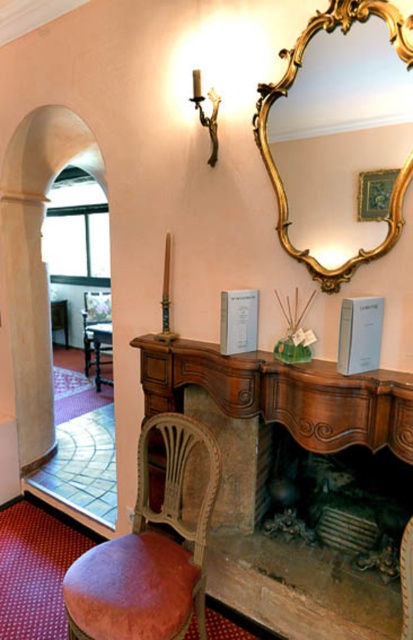
Who is taller, wooden fireplace at center or velvet red armchair at lower left?

With more height is wooden fireplace at center.

Identify the location of wooden fireplace at center. tap(285, 394).

Between point (152, 401) and point (218, 465), which one is positioned behind?

The point (152, 401) is more distant.

Where is `wooden fireplace at center`? This screenshot has width=413, height=640. wooden fireplace at center is located at coordinates (285, 394).

What do you see at coordinates (147, 554) in the screenshot? This screenshot has width=413, height=640. I see `velvet red armchair at lower left` at bounding box center [147, 554].

Does velvet red armchair at lower left have a lesser height compared to wooden armchair at left?

In fact, velvet red armchair at lower left may be taller than wooden armchair at left.

Is point (185, 611) behind point (104, 312)?

No.

Find the location of a particular element. The width and height of the screenshot is (413, 640). velvet red armchair at lower left is located at coordinates (147, 554).

Is wooden fireplace at center wider than gold ornate mirror at upper center?

Indeed, wooden fireplace at center has a greater width compared to gold ornate mirror at upper center.

Does wooden fireplace at center have a larger size compared to gold ornate mirror at upper center?

Indeed, wooden fireplace at center has a larger size compared to gold ornate mirror at upper center.

Locate an element on the screen. The image size is (413, 640). wooden fireplace at center is located at coordinates (285, 394).